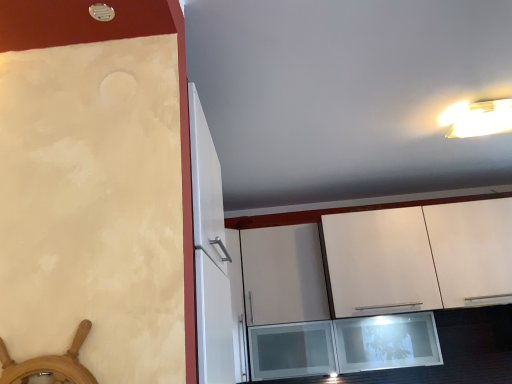
Question: In terms of size, does white matte cabinet at upper center appear bigger or smaller than white plastic light fixture at upper right?

Choices:
 (A) big
 (B) small

Answer: (A)

Question: From a real-world perspective, is white matte cabinet at upper center positioned above or below white plastic light fixture at upper right?

Choices:
 (A) below
 (B) above

Answer: (A)

Question: Relative to white plastic light fixture at upper right, is white matte cabinet at upper center in front or behind?

Choices:
 (A) front
 (B) behind

Answer: (B)

Question: From their relative heights in the image, would you say white plastic light fixture at upper right is taller or shorter than white matte cabinet at upper center?

Choices:
 (A) tall
 (B) short

Answer: (B)

Question: Is white plastic light fixture at upper right wider or thinner than white matte cabinet at upper center?

Choices:
 (A) wide
 (B) thin

Answer: (B)

Question: Visually, is white plastic light fixture at upper right positioned to the left or to the right of white matte cabinet at upper center?

Choices:
 (A) left
 (B) right

Answer: (B)

Question: From the image's perspective, is white plastic light fixture at upper right located above or below white matte cabinet at upper center?

Choices:
 (A) below
 (B) above

Answer: (B)